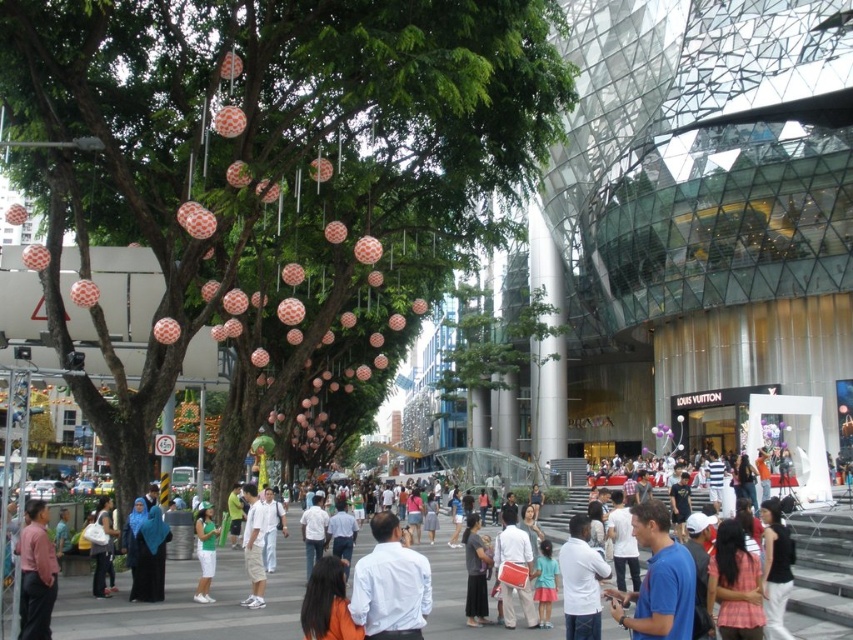
Question: Which is nearer to the white cotton shirt at center?

Choices:
 (A) green fabric shorts at center
 (B) white matte shirt at center
 (C) blue cotton shirt at center

Answer: (A)

Question: Which point appears farthest from the camera in this image?

Choices:
 (A) (410, 566)
 (B) (206, 522)
 (C) (166, 244)

Answer: (C)

Question: Estimate the real-world distances between objects in this image. Which object is closer to the matte pink shirt at lower left?

Choices:
 (A) green fabric shorts at center
 (B) white cotton shirt at center

Answer: (A)

Question: Can you confirm if blue cotton shirt at center is positioned below dark gray fabric dress at center?

Choices:
 (A) yes
 (B) no

Answer: (B)

Question: Does dark gray fabric dress at center have a lesser width compared to white cotton shirt at center?

Choices:
 (A) yes
 (B) no

Answer: (A)

Question: Does matte orange paper lanterns at center have a smaller size compared to green fabric shorts at center?

Choices:
 (A) no
 (B) yes

Answer: (A)